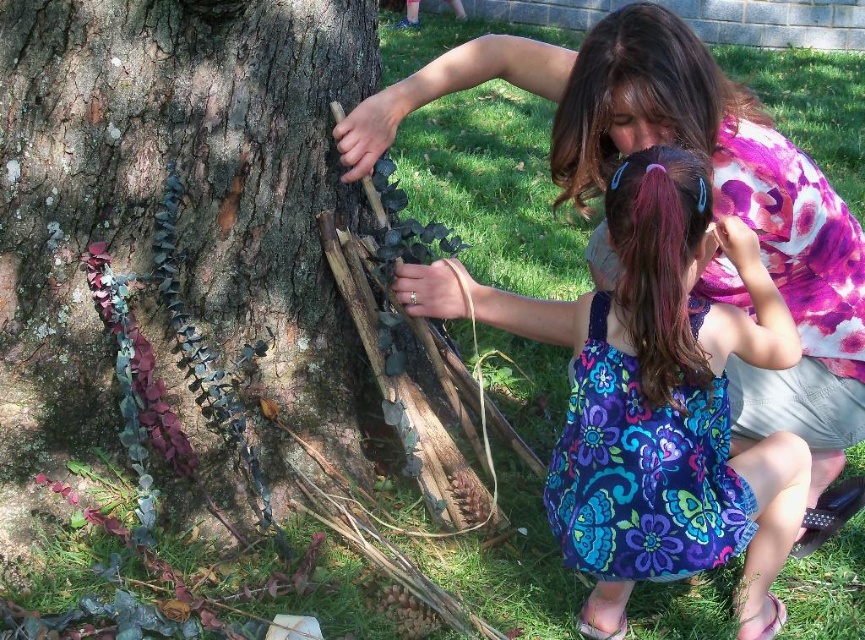
Is green mossy bark at left wider than floral dress at center?

In fact, green mossy bark at left might be narrower than floral dress at center.

Where is `green mossy bark at left`? The height and width of the screenshot is (640, 865). green mossy bark at left is located at coordinates (158, 195).